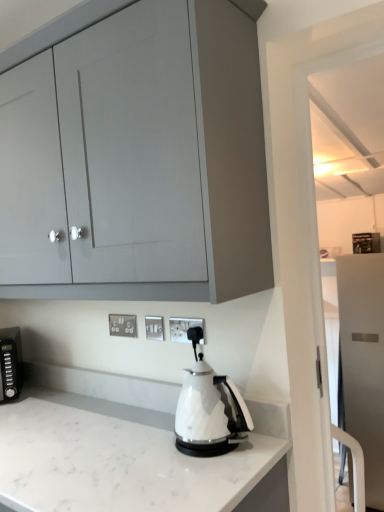
Question: From the image's perspective, would you say white plastic electric outlet at center, the second electric outlet viewed from the front, is positioned over white plastic electric outlet at center, the first electric outlet when ordered from right to left?

Choices:
 (A) no
 (B) yes

Answer: (A)

Question: Is white plastic electric outlet at center, the second electric outlet in the left-to-right sequence, taller than white plastic electric outlet at center, the third electric outlet viewed from the left?

Choices:
 (A) yes
 (B) no

Answer: (B)

Question: Are white plastic electric outlet at center, placed as the 2th electric outlet when sorted from right to left, and white plastic electric outlet at center, the first electric outlet when ordered from right to left, located far from each other?

Choices:
 (A) no
 (B) yes

Answer: (A)

Question: Can you confirm if white plastic electric outlet at center, the second electric outlet viewed from the front, is bigger than white plastic electric outlet at center, which appears as the first electric outlet when viewed from the front?

Choices:
 (A) no
 (B) yes

Answer: (B)

Question: Does white plastic electric outlet at center, placed as the 2th electric outlet when sorted from right to left, have a lesser width compared to white plastic electric outlet at center, which appears as the first electric outlet when viewed from the front?

Choices:
 (A) no
 (B) yes

Answer: (A)

Question: Is white marble countertop at center taller or shorter than silver metallic electrical outlet at center, the third electric outlet in the right-to-left sequence?

Choices:
 (A) short
 (B) tall

Answer: (B)

Question: Considering their positions, is white marble countertop at center located in front of or behind silver metallic electrical outlet at center, the third electric outlet from the front?

Choices:
 (A) front
 (B) behind

Answer: (A)

Question: Is point (119, 404) closer or farther from the camera than point (110, 317)?

Choices:
 (A) farther
 (B) closer

Answer: (B)

Question: From a real-world perspective, is white marble countertop at center positioned above or below silver metallic electrical outlet at center, the first electric outlet in the back-to-front sequence?

Choices:
 (A) below
 (B) above

Answer: (A)

Question: From a real-world perspective, is silver metallic electrical outlet at center, the third electric outlet from the front, physically located above or below satin white refrigerator at right, which is the second cabinetry from front to back?

Choices:
 (A) below
 (B) above

Answer: (B)

Question: Relative to satin white refrigerator at right, placed as the 1th cabinetry when sorted from right to left, is silver metallic electrical outlet at center, the first electric outlet in the back-to-front sequence, in front or behind?

Choices:
 (A) behind
 (B) front

Answer: (B)

Question: Considering the positions of silver metallic electrical outlet at center, the third electric outlet in the right-to-left sequence, and satin white refrigerator at right, the second cabinetry viewed from the top, in the image, is silver metallic electrical outlet at center, the third electric outlet in the right-to-left sequence, bigger or smaller than satin white refrigerator at right, the second cabinetry viewed from the top,?

Choices:
 (A) small
 (B) big

Answer: (A)

Question: Is silver metallic electrical outlet at center, the first electric outlet in the back-to-front sequence, to the left or to the right of satin white refrigerator at right, which is the 1th cabinetry in back-to-front order, in the image?

Choices:
 (A) left
 (B) right

Answer: (A)

Question: From a real-world perspective, is white marble countertop at center above or below matte gray cabinet at upper left, arranged as the first cabinetry when viewed from the top?

Choices:
 (A) below
 (B) above

Answer: (A)

Question: Is point (198, 503) closer or farther from the camera than point (256, 276)?

Choices:
 (A) farther
 (B) closer

Answer: (B)